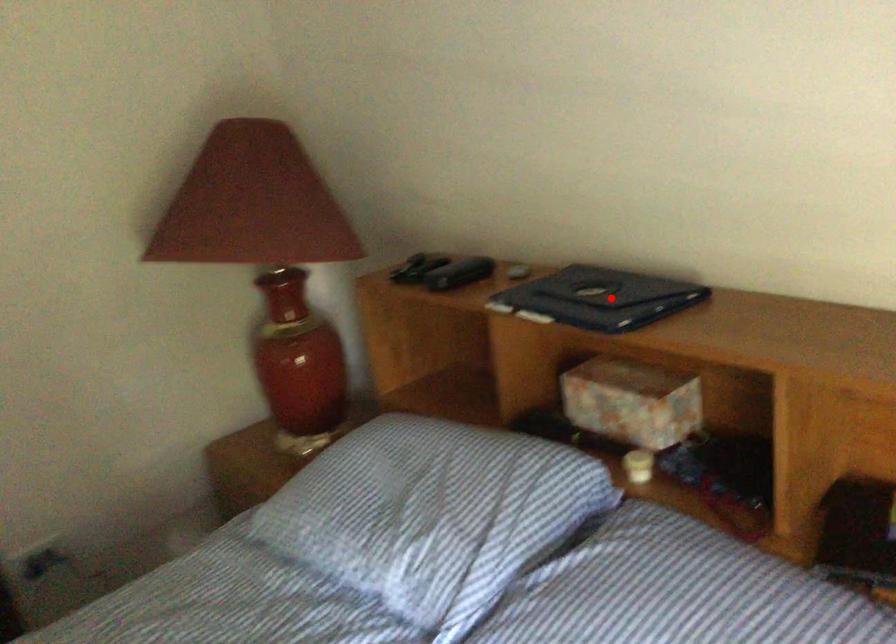
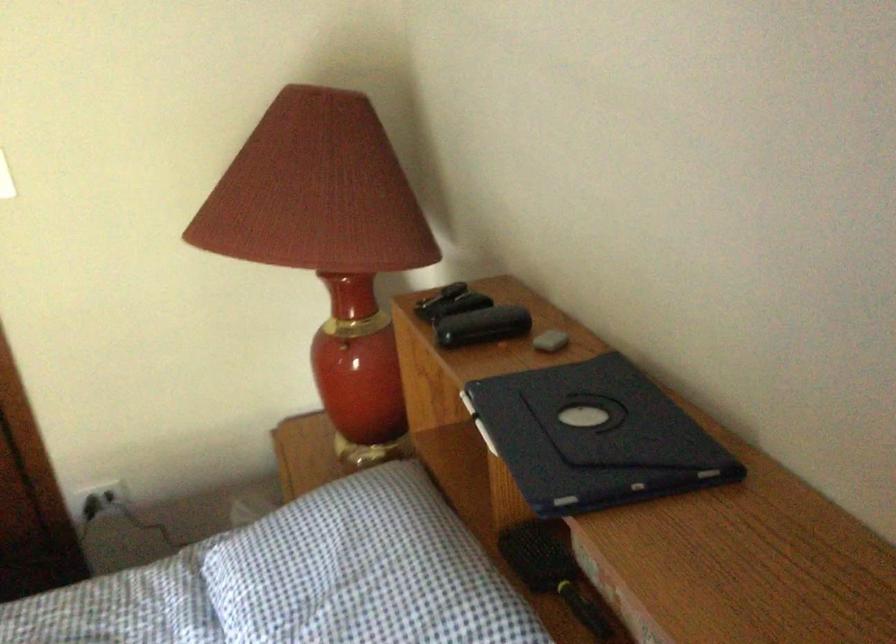
Question: I am providing you with two images of the same scene from different viewpoints. A red point is marked on the first image. Is the red point's position out of view in image 2?

Choices:
 (A) Yes
 (B) No

Answer: (B)